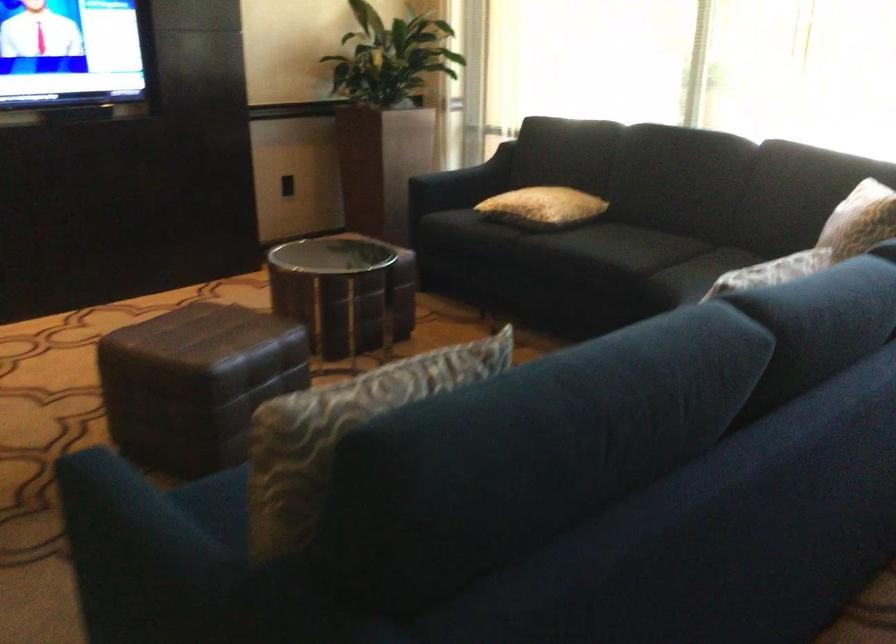
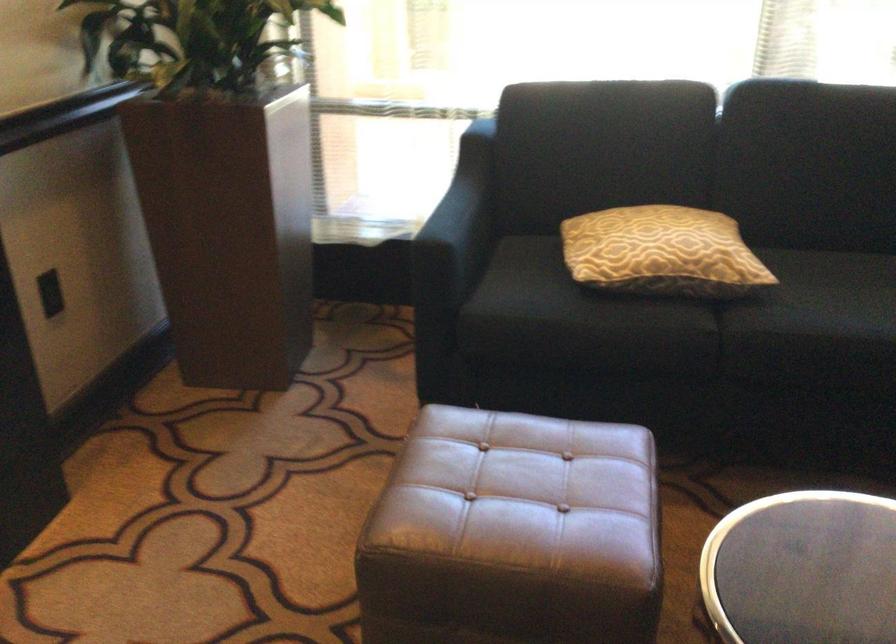
The point at [517,200] is marked in the first image. Where is the corresponding point in the second image?

(661, 252)